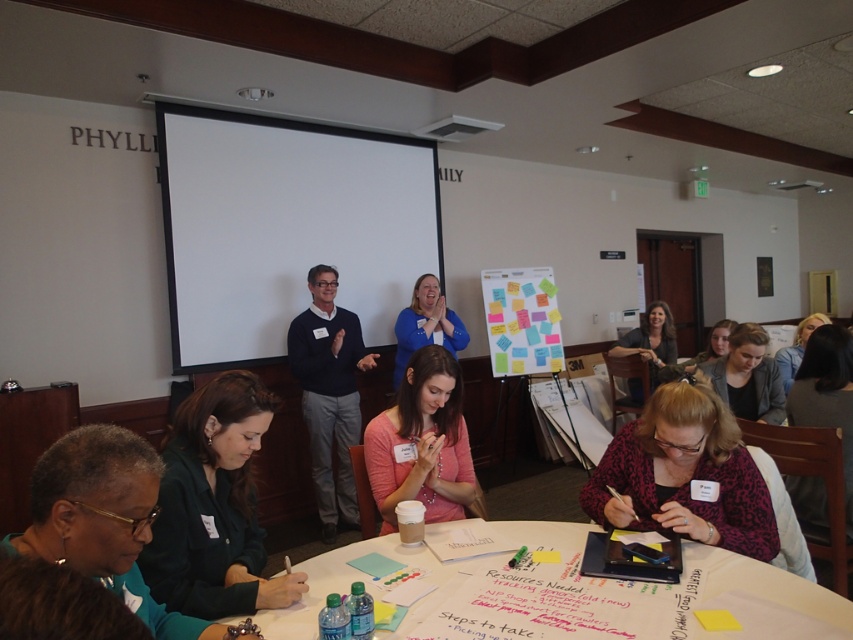
Can you confirm if leopard print sweater at lower right is thinner than dark blue sweater at center?

Correct, leopard print sweater at lower right's width is less than dark blue sweater at center's.

Does leopard print sweater at lower right appear on the left side of dark blue sweater at center?

In fact, leopard print sweater at lower right is to the right of dark blue sweater at center.

Locate an element on the screen. Image resolution: width=853 pixels, height=640 pixels. leopard print sweater at lower right is located at coordinates (685, 474).

Who is higher up, white matte projection screen at upper center or matte green shirt at lower left?

Positioned higher is white matte projection screen at upper center.

Can you confirm if white matte projection screen at upper center is positioned to the left of matte green shirt at lower left?

Yes, white matte projection screen at upper center is to the left of matte green shirt at lower left.

Is point (402, 202) closer to viewer compared to point (201, 563)?

No.

You are a GUI agent. You are given a task and a screenshot of the screen. Output one action in this format:
    pyautogui.click(x=<x>, y=<y>)
    Task: Click on the white matte projection screen at upper center
    The width and height of the screenshot is (853, 640).
    Given the screenshot: What is the action you would take?
    pyautogui.click(x=285, y=227)

Can you confirm if dark blue sweater at center is wider than colorful paper notes at center?

In fact, dark blue sweater at center might be narrower than colorful paper notes at center.

Does dark blue sweater at center have a lesser width compared to colorful paper notes at center?

Yes.

Who is more forward, (349, 436) or (485, 292)?

Positioned in front is point (349, 436).

The image size is (853, 640). Identify the location of dark blue sweater at center. (329, 394).